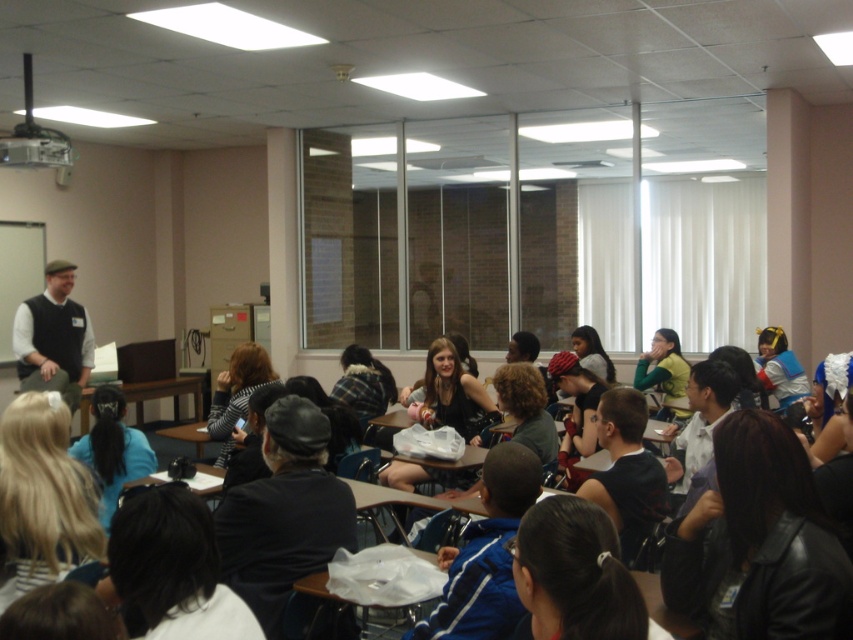
Question: Which of the following is the closest to the observer?

Choices:
 (A) (724, 600)
 (B) (57, 353)

Answer: (A)

Question: Which point is closer to the camera?

Choices:
 (A) (706, 596)
 (B) (55, 348)

Answer: (A)

Question: Can you confirm if black leather jacket at lower right is wider than matte black vest at left?

Choices:
 (A) yes
 (B) no

Answer: (B)

Question: Is black leather jacket at lower right above matte black vest at left?

Choices:
 (A) yes
 (B) no

Answer: (B)

Question: Can you confirm if black leather jacket at lower right is wider than matte black vest at left?

Choices:
 (A) yes
 (B) no

Answer: (B)